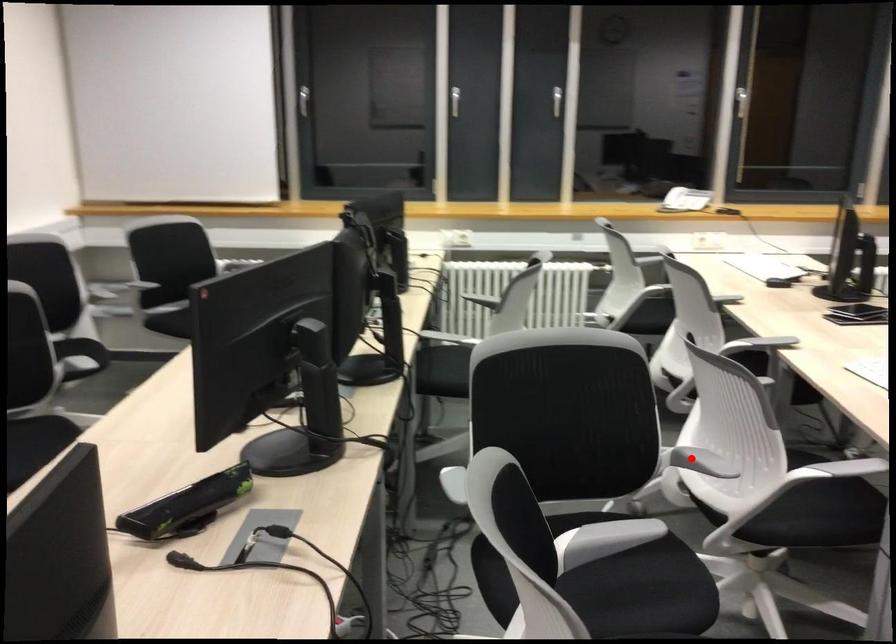
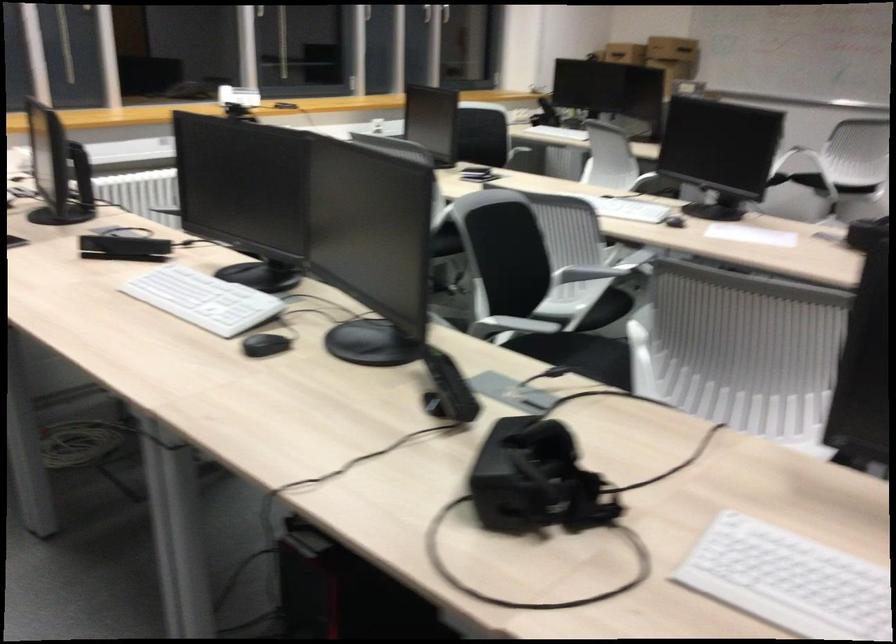
Find the pixel in the second image that matches the highlighted location in the first image.

(586, 272)